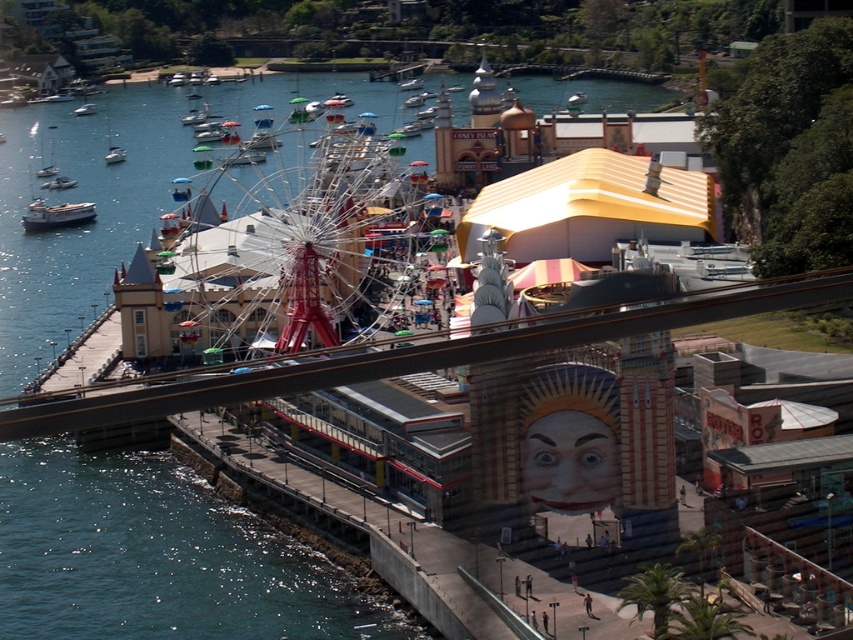
You are standing at the center of the amusement park and see the point marked at coordinates (56, 214). What object is located at that point?

The point at coordinates (56, 214) corresponds to the white matte boat at left.

You are a visitor at the Luna Park in Sydney and want to take a photo of both the white matte boat at left and the white plastic boat at lower left. Which boat should you position to the right side to include both in your photo?

You should position the white plastic boat at lower left to the right side because the white matte boat at left is already on the right side of it.

You are standing at the Ferris wheel and want to take a photo of the two points marked in the image. Which point, point (68,218) or point (48,182), will appear larger in your photo?

Point (68,218) will appear larger in the photo because it is closer to the camera than point (48,182).